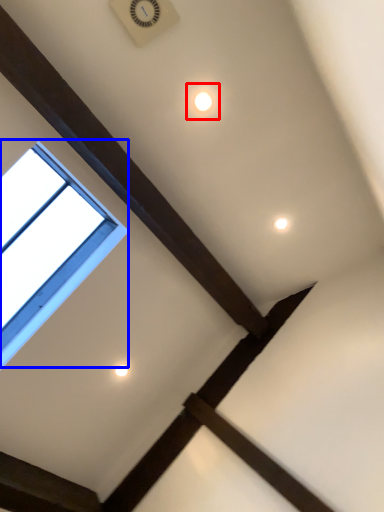
Question: Which object appears closest to the camera in this image, dot (highlighted by a red box) or window (highlighted by a blue box)?

Choices:
 (A) dot
 (B) window

Answer: (B)